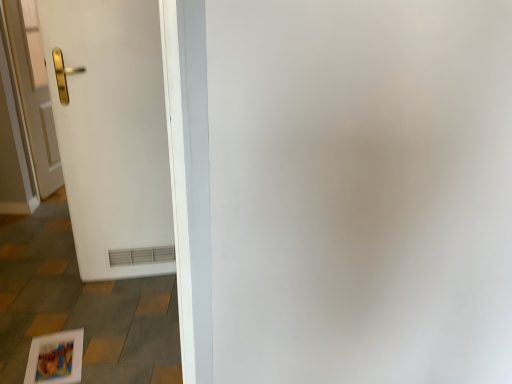
Question: Would you say white matte door at left, which appears as the 1th door when viewed from the right, is to the left or to the right of gold metallic handle at left, which is the 2th door in front-to-back order, in the picture?

Choices:
 (A) left
 (B) right

Answer: (B)

Question: Is white matte door at left, marked as the 1th door in a front-to-back arrangement, in front of or behind gold metallic handle at left, which is the 2th door in front-to-back order, in the image?

Choices:
 (A) behind
 (B) front

Answer: (B)

Question: Is point (153, 160) positioned closer to the camera than point (20, 49)?

Choices:
 (A) farther
 (B) closer

Answer: (B)

Question: From the image's perspective, is gold metallic handle at left, the 1th door from the left, positioned above or below white matte door at left, which appears as the second door when viewed from the left?

Choices:
 (A) above
 (B) below

Answer: (A)

Question: Would you say gold metallic handle at left, the 1th door from the left, is to the left or to the right of white matte door at left, which appears as the second door when viewed from the left, in the picture?

Choices:
 (A) left
 (B) right

Answer: (A)

Question: Is gold metallic handle at left, positioned as the 1th door in back-to-front order, situated inside white matte door at left, which appears as the 1th door when viewed from the right, or outside?

Choices:
 (A) outside
 (B) inside

Answer: (A)

Question: From a real-world perspective, relative to white matte door at left, which appears as the second door when viewed from the left, is gold metallic handle at left, the second door in the right-to-left sequence, vertically above or below?

Choices:
 (A) below
 (B) above

Answer: (A)